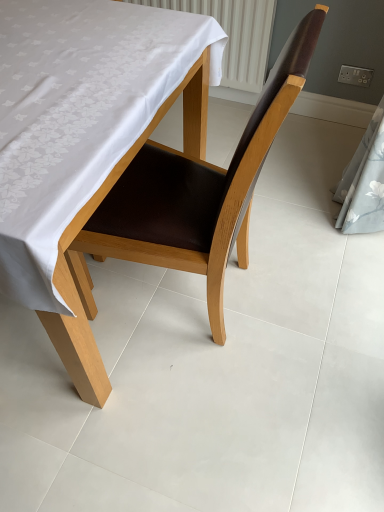
Locate an element on the screen. free space above white fabric-covered table at center (from a real-world perspective) is located at coordinates (63, 54).